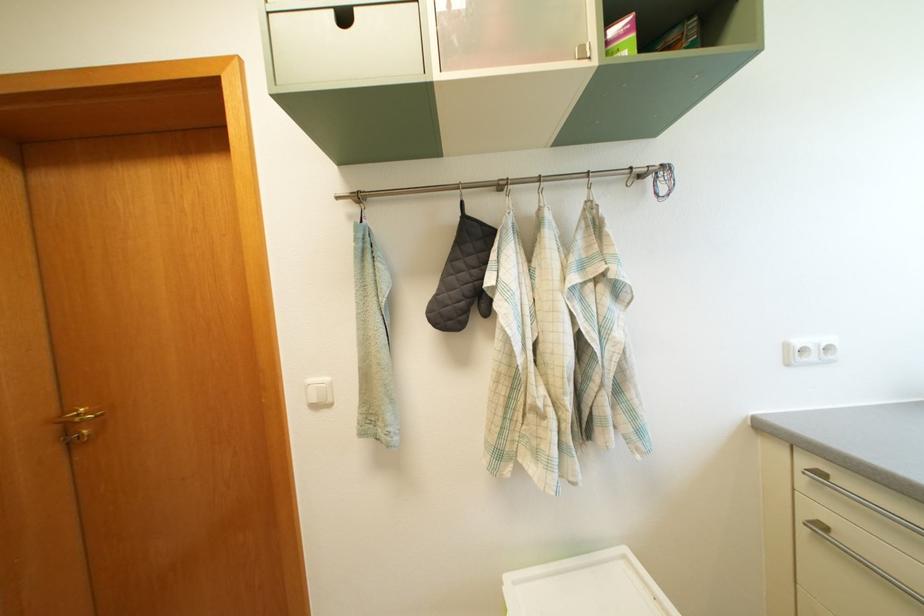
Image resolution: width=924 pixels, height=616 pixels. I want to click on metal carabiner, so click(531, 182).